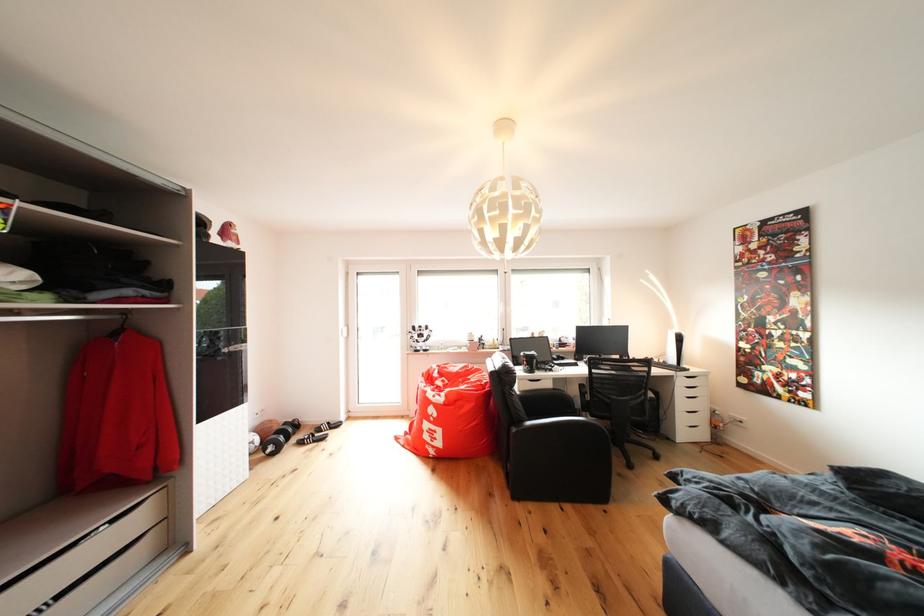
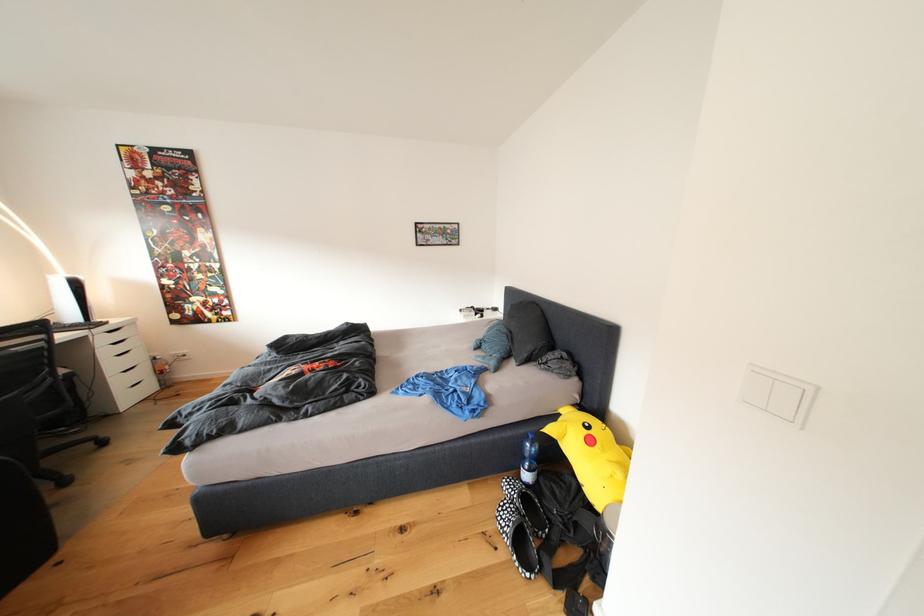
The point at (690, 408) is marked in the first image. Where is the corresponding point in the second image?

(120, 370)